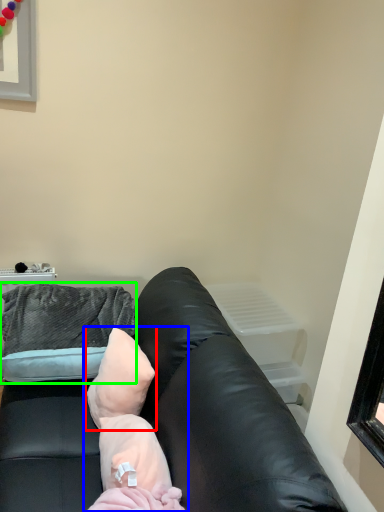
Question: Which is farther away from pillow (highlighted by a red box)? newborn (highlighted by a blue box) or throw pillow (highlighted by a green box)?

Choices:
 (A) newborn
 (B) throw pillow

Answer: (B)